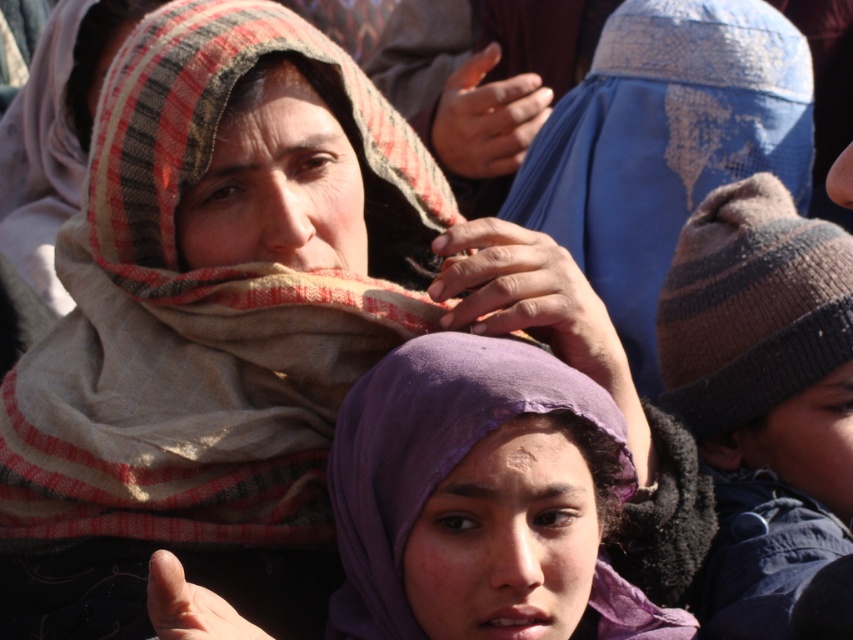
Where is `purple fabric headscarf at center`? This screenshot has width=853, height=640. purple fabric headscarf at center is located at coordinates (451, 481).

Is point (549, 378) positioned in front of point (659, 209)?

Yes, it is.

What are the coordinates of `purple fabric headscarf at center` in the screenshot? It's located at (451, 481).

Which is more to the right, purple fabric headscarf at center or dry skin hand at center?

From the viewer's perspective, dry skin hand at center appears more on the right side.

Which is behind, point (476, 429) or point (460, 321)?

Point (460, 321)

Does point (601, 582) lie in front of point (444, 284)?

Yes.

Identify the location of purple fabric headscarf at center. (451, 481).

Is point (682, 419) farther from camera compared to point (477, 326)?

Yes, it is behind point (477, 326).

Is knitted woolen hat at right below dry skin hand at center?

Indeed, knitted woolen hat at right is positioned under dry skin hand at center.

Between point (775, 388) and point (463, 314), which one is positioned behind?

Point (775, 388)

You are a GUI agent. You are given a task and a screenshot of the screen. Output one action in this format:
    pyautogui.click(x=<x>, y=<y>)
    Task: Click on the knitted woolen hat at right
    
    Given the screenshot: What is the action you would take?
    pyautogui.click(x=762, y=394)